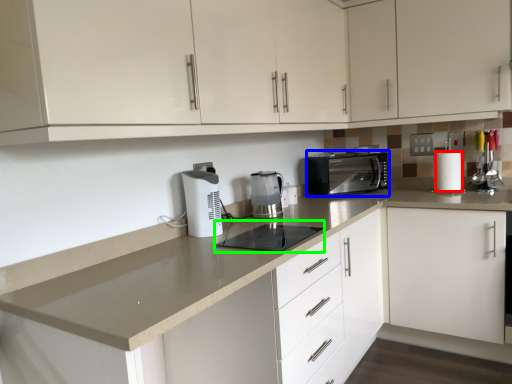
Question: Which is farther away from paper towel (highlighted by a red box)? kitchen appliance (highlighted by a blue box) or appliance (highlighted by a green box)?

Choices:
 (A) kitchen appliance
 (B) appliance

Answer: (B)